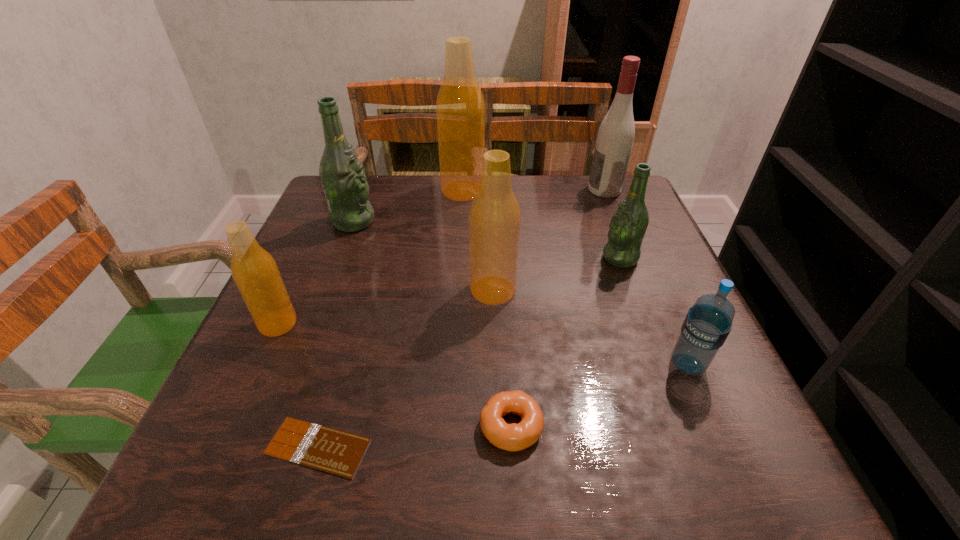
Image resolution: width=960 pixels, height=540 pixels. I want to click on vacant space at the near edge of the desktop, so click(451, 455).

I want to click on vacant area at the left edge of the desktop, so click(332, 261).

Identify the location of vacant space at the right edge of the desktop. This screenshot has width=960, height=540. (606, 232).

What are the coordinates of `free point at the far left corner` in the screenshot? It's located at (377, 191).

The image size is (960, 540). In the image, there is a desktop. What are the coordinates of `vacant space at the near left corner` in the screenshot? It's located at (201, 450).

Where is `unoccupied position between the leftmost tan beer bottle and the fifth farthest object`? The image size is (960, 540). unoccupied position between the leftmost tan beer bottle and the fifth farthest object is located at coordinates (x=386, y=307).

What are the coordinates of `free area in between the second nearest tan beer bottle and the doughnut` in the screenshot? It's located at (502, 358).

Locate an element on the screen. This screenshot has width=960, height=540. free space that is in between the left green beer bottle and the blue water bottle is located at coordinates (520, 293).

At what (x,y) coordinates should I click in order to perform the action: click on blank region between the tallest beer bottle and the fourth farthest object. Please return your answer as a coordinate pair (x, y). Looking at the image, I should click on (541, 224).

Identify the location of free spot between the farthest beer bottle and the leftmost tan beer bottle. (371, 257).